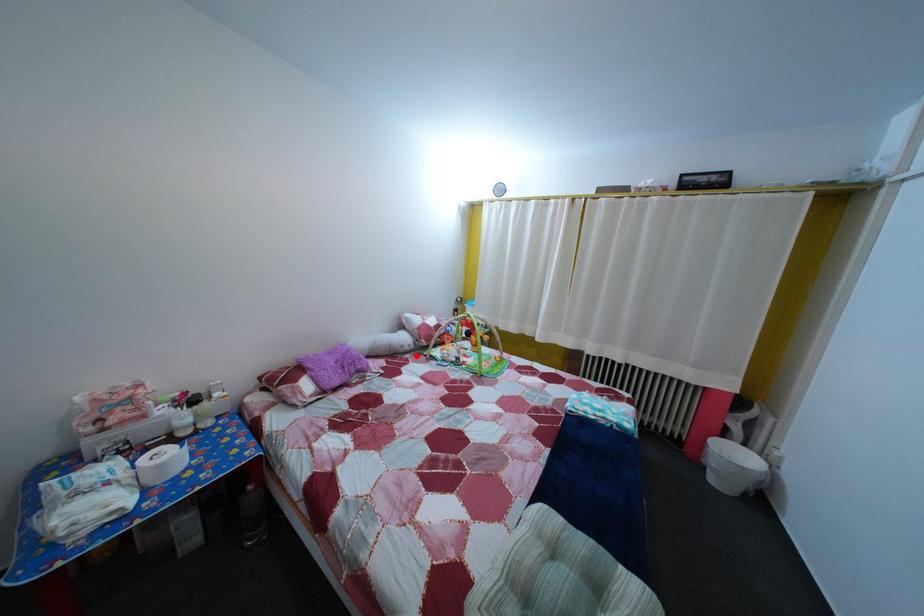
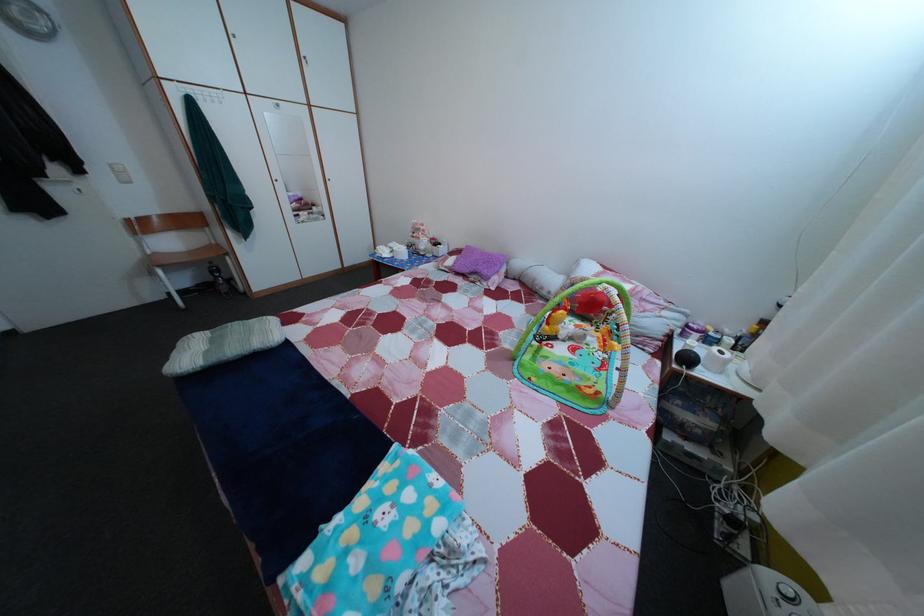
Question: I am providing you with two images of the same scene from different viewpoints. Image1 has a red point marked. In image2, the corresponding 3D location appears at what relative position? Reply with the corresponding letter.

Choices:
 (A) Closer
 (B) Farther

Answer: (A)